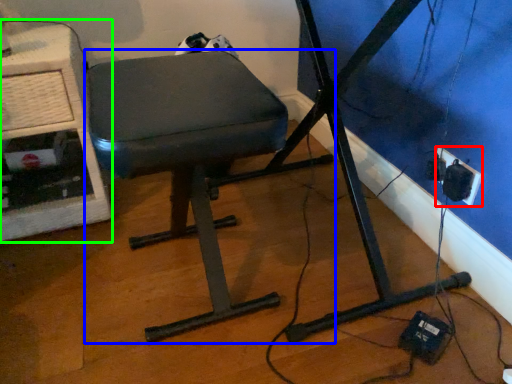
Question: Considering the real-world distances, which object is farthest from electric outlet (highlighted by a red box)? furniture (highlighted by a blue box) or computer desk (highlighted by a green box)?

Choices:
 (A) furniture
 (B) computer desk

Answer: (B)